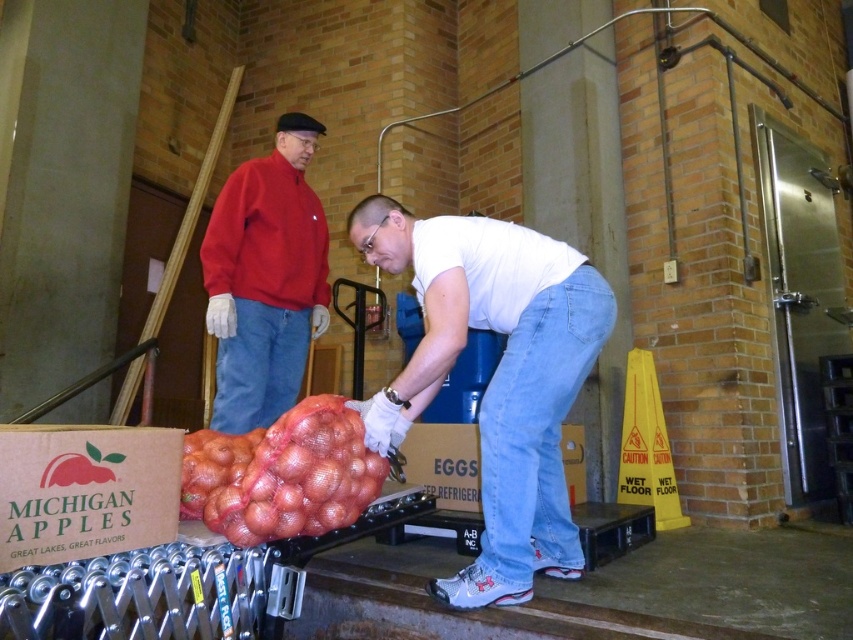
Question: Which of the following is the closest to the observer?

Choices:
 (A) (277, 339)
 (B) (561, 321)
 (C) (193, 506)
 (D) (323, 131)

Answer: (C)

Question: From the image, what is the correct spatial relationship of light blue denim jeans at lower center in relation to red mesh bag of apples at center?

Choices:
 (A) below
 (B) above

Answer: (B)

Question: Can you confirm if light blue denim jeans at lower center is thinner than blue denim jeans at center?

Choices:
 (A) no
 (B) yes

Answer: (A)

Question: Estimate the real-world distances between objects in this image. Which object is farther from the white matte shirt at center?

Choices:
 (A) red mesh bag of apples at center
 (B) light blue denim jeans at lower center
 (C) blue denim jeans at center

Answer: (C)

Question: Which point is closer to the camera taking this photo?

Choices:
 (A) pos(230,221)
 (B) pos(500,289)
 (C) pos(505,465)
 (D) pos(318,445)

Answer: (D)

Question: Is the position of white matte shirt at center less distant than that of blue denim jeans at center?

Choices:
 (A) no
 (B) yes

Answer: (B)